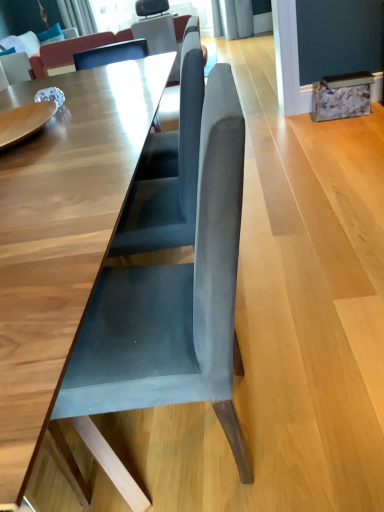
Question: From a real-world perspective, is velvet blue couch at upper left, arranged as the second couch when viewed from the front, located beneath suede couch at upper center, which is the 1th couch in front-to-back order?

Choices:
 (A) no
 (B) yes

Answer: (A)

Question: From a real-world perspective, is velvet blue couch at upper left, marked as the 1th couch in a left-to-right arrangement, located higher than suede couch at upper center, which appears as the first couch when viewed from the right?

Choices:
 (A) no
 (B) yes

Answer: (B)

Question: Considering the relative positions of velvet blue couch at upper left, marked as the 1th couch in a left-to-right arrangement, and suede couch at upper center, which is the 1th couch in front-to-back order, in the image provided, is velvet blue couch at upper left, marked as the 1th couch in a left-to-right arrangement, to the left of suede couch at upper center, which is the 1th couch in front-to-back order, from the viewer's perspective?

Choices:
 (A) no
 (B) yes

Answer: (B)

Question: Considering the relative sizes of velvet blue couch at upper left, which appears as the 1th couch when viewed from the back, and suede couch at upper center, which appears as the first couch when viewed from the right, in the image provided, is velvet blue couch at upper left, which appears as the 1th couch when viewed from the back, bigger than suede couch at upper center, which appears as the first couch when viewed from the right,?

Choices:
 (A) no
 (B) yes

Answer: (B)

Question: Considering the relative sizes of velvet blue couch at upper left, placed as the 2th couch when sorted from right to left, and suede couch at upper center, which appears as the first couch when viewed from the right, in the image provided, is velvet blue couch at upper left, placed as the 2th couch when sorted from right to left, smaller than suede couch at upper center, which appears as the first couch when viewed from the right,?

Choices:
 (A) no
 (B) yes

Answer: (A)

Question: Is suede couch at upper center, the second couch from the back, taller or shorter than suede gray chair at center?

Choices:
 (A) short
 (B) tall

Answer: (A)

Question: Is suede couch at upper center, which appears as the first couch when viewed from the right, inside the boundaries of suede gray chair at center, or outside?

Choices:
 (A) outside
 (B) inside

Answer: (A)

Question: From the image's perspective, is suede couch at upper center, which appears as the first couch when viewed from the right, positioned above or below suede gray chair at center?

Choices:
 (A) below
 (B) above

Answer: (B)

Question: Is point (57, 44) closer or farther from the camera than point (223, 324)?

Choices:
 (A) farther
 (B) closer

Answer: (A)

Question: From the image's perspective, is suede gray chair at center located above or below velvet blue couch at upper left, arranged as the second couch when viewed from the front?

Choices:
 (A) above
 (B) below

Answer: (B)

Question: From a real-world perspective, relative to velvet blue couch at upper left, which appears as the 1th couch when viewed from the back, is suede gray chair at center vertically above or below?

Choices:
 (A) below
 (B) above

Answer: (A)

Question: From their relative heights in the image, would you say suede gray chair at center is taller or shorter than velvet blue couch at upper left, marked as the 1th couch in a left-to-right arrangement?

Choices:
 (A) tall
 (B) short

Answer: (A)

Question: Is point (152, 318) positioned closer to the camera than point (36, 60)?

Choices:
 (A) closer
 (B) farther

Answer: (A)

Question: Considering their positions, is suede couch at upper center, which is the 1th couch in front-to-back order, located in front of or behind velvet blue couch at upper left, placed as the 2th couch when sorted from right to left?

Choices:
 (A) front
 (B) behind

Answer: (A)

Question: From their relative heights in the image, would you say suede couch at upper center, which is the 1th couch in front-to-back order, is taller or shorter than velvet blue couch at upper left, marked as the 1th couch in a left-to-right arrangement?

Choices:
 (A) short
 (B) tall

Answer: (B)